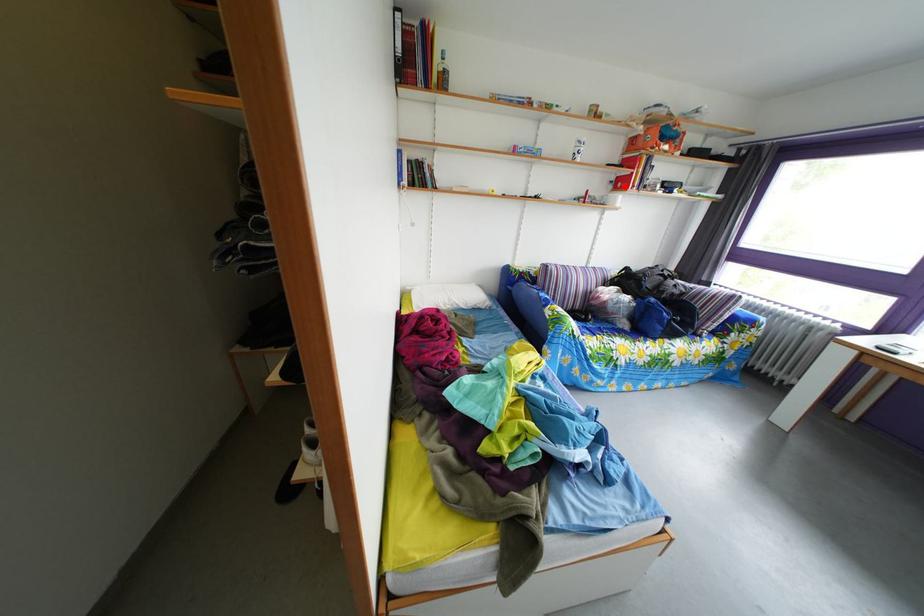
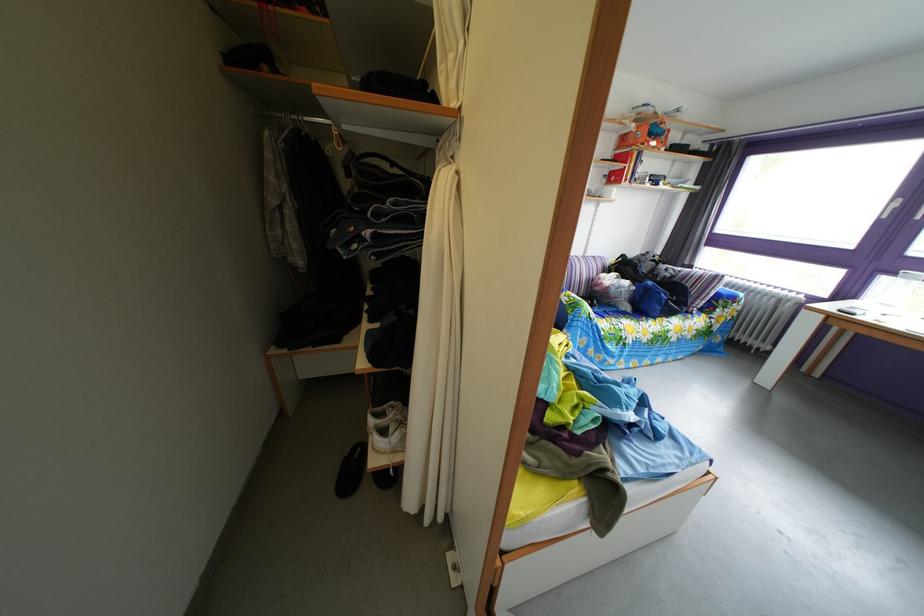
Where in the second image is the point corresponding to the highlighted location from the first image?

(618, 180)